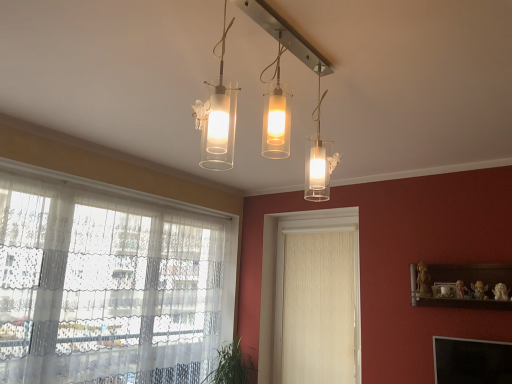
Question: Is green leafy plant at lower left positioned with its back to clear glass light fixture at center?

Choices:
 (A) no
 (B) yes

Answer: (A)

Question: Can you confirm if green leafy plant at lower left is smaller than clear glass light fixture at center?

Choices:
 (A) yes
 (B) no

Answer: (A)

Question: Are green leafy plant at lower left and clear glass light fixture at center making contact?

Choices:
 (A) no
 (B) yes

Answer: (A)

Question: Does green leafy plant at lower left have a lesser height compared to clear glass light fixture at center?

Choices:
 (A) no
 (B) yes

Answer: (B)

Question: Is green leafy plant at lower left bigger than clear glass light fixture at center?

Choices:
 (A) yes
 (B) no

Answer: (B)

Question: In terms of size, does white textured curtain at center appear bigger or smaller than clear glass light fixture at center?

Choices:
 (A) small
 (B) big

Answer: (A)

Question: Considering the positions of white textured curtain at center and clear glass light fixture at center in the image, is white textured curtain at center taller or shorter than clear glass light fixture at center?

Choices:
 (A) short
 (B) tall

Answer: (B)

Question: Would you say white textured curtain at center is inside or outside clear glass light fixture at center?

Choices:
 (A) outside
 (B) inside

Answer: (A)

Question: Relative to clear glass light fixture at center, is white textured curtain at center in front or behind?

Choices:
 (A) front
 (B) behind

Answer: (B)

Question: Considering their positions, is white textured curtain at center located in front of or behind wooden shelf at right?

Choices:
 (A) behind
 (B) front

Answer: (A)

Question: From a real-world perspective, relative to wooden shelf at right, is white textured curtain at center vertically above or below?

Choices:
 (A) below
 (B) above

Answer: (A)

Question: From the image's perspective, is white textured curtain at center above or below wooden shelf at right?

Choices:
 (A) below
 (B) above

Answer: (A)

Question: In terms of width, does white textured curtain at center look wider or thinner when compared to wooden shelf at right?

Choices:
 (A) wide
 (B) thin

Answer: (B)

Question: From the image's perspective, is wooden shelf at right positioned above or below transparent lace curtain at left?

Choices:
 (A) above
 (B) below

Answer: (A)

Question: Considering their positions, is wooden shelf at right located in front of or behind transparent lace curtain at left?

Choices:
 (A) behind
 (B) front

Answer: (A)